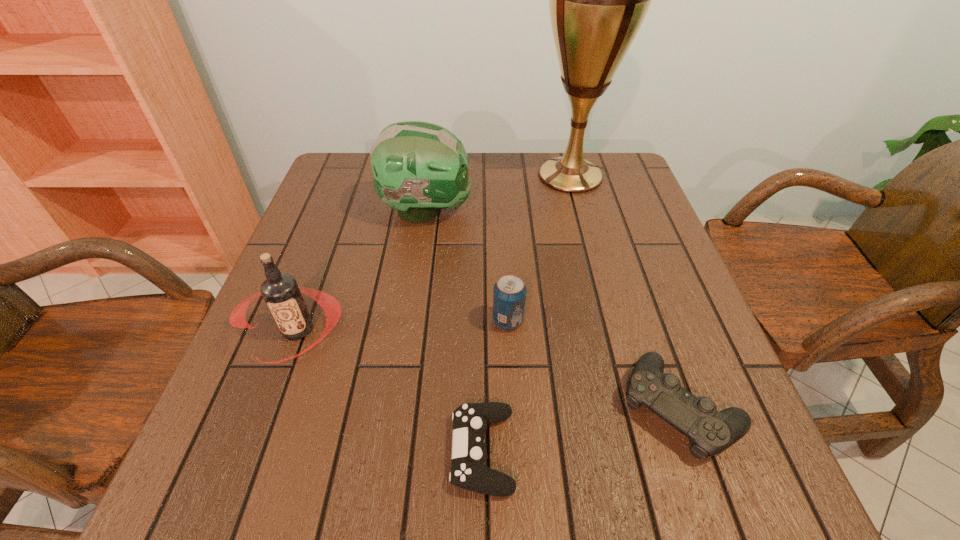
Identify the location of object that can be found as the closest to the shorter control. (509, 293).

Identify which object is located as the nearest to the pop soda. Please provide its 2D coordinates. Your answer should be formatted as a tuple, i.e. [(x, y)], where the tuple contains the x and y coordinates of a point satisfying the conditions above.

[(470, 420)]

At what (x,y) coordinates should I click in order to perform the action: click on free space in the image that satisfies the following two spatial constraints: 1. on the visor of the second tallest object; 2. on the label of the fourth shortest object. Please return your answer as a coordinate pair (x, y). This screenshot has height=540, width=960. Looking at the image, I should click on (409, 330).

Identify the location of free space that satisfies the following two spatial constraints: 1. on the back side of the trophy cup; 2. on the left side of the fourth tallest object. This screenshot has height=540, width=960. (499, 176).

Where is `free region that satisfies the following two spatial constraints: 1. on the visor of the fourth tallest object; 2. on the right side of the second tallest object`? The image size is (960, 540). free region that satisfies the following two spatial constraints: 1. on the visor of the fourth tallest object; 2. on the right side of the second tallest object is located at coordinates (410, 321).

Identify the location of free point that satisfies the following two spatial constraints: 1. on the visor of the football helmet; 2. on the label of the root beer. [409, 330].